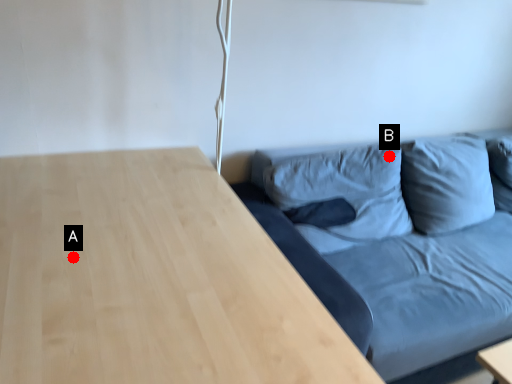
Question: Two points are circled on the image, labeled by A and B beside each circle. Among these points, which one is nearest to the camera?

Choices:
 (A) A is closer
 (B) B is closer

Answer: (A)